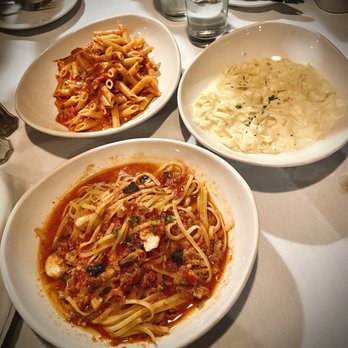
Find the location of a particular element. This screenshot has width=348, height=348. white bowls is located at coordinates (248, 207), (286, 158), (29, 99).